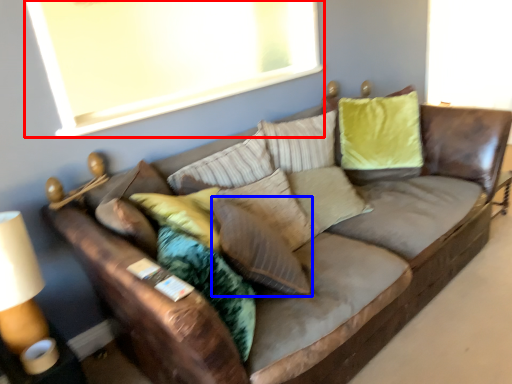
Question: Among these objects, which one is farthest to the camera, window screen (highlighted by a red box) or pillow (highlighted by a blue box)?

Choices:
 (A) window screen
 (B) pillow

Answer: (A)